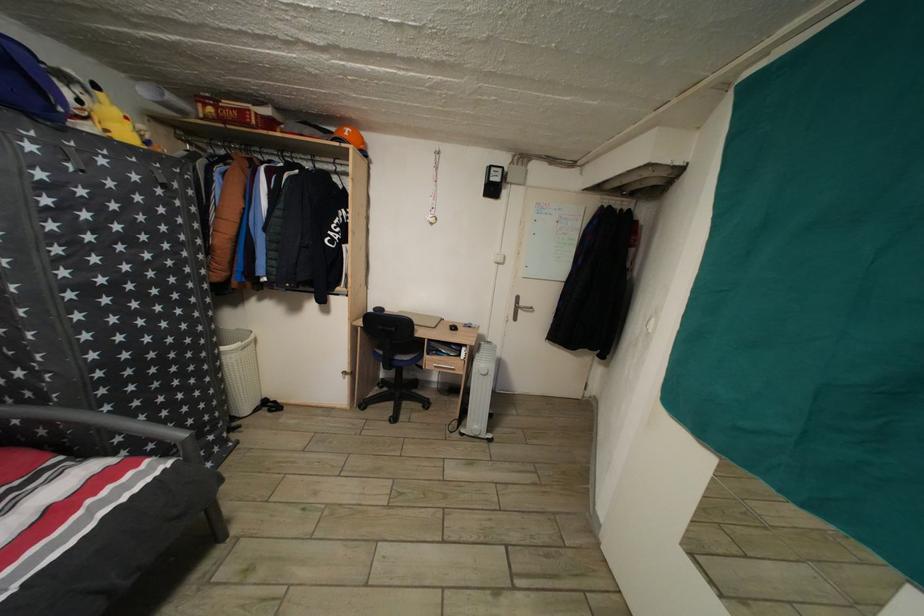
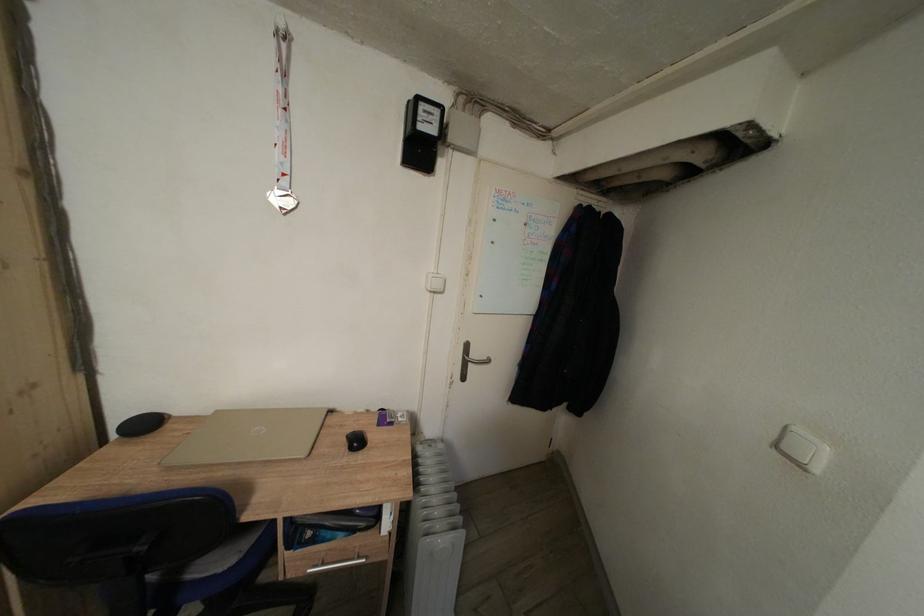
Question: The images are taken continuously from a first-person perspective. In which direction is your viewpoint rotating?

Choices:
 (A) Left
 (B) Right
 (C) Up
 (D) Down

Answer: (B)